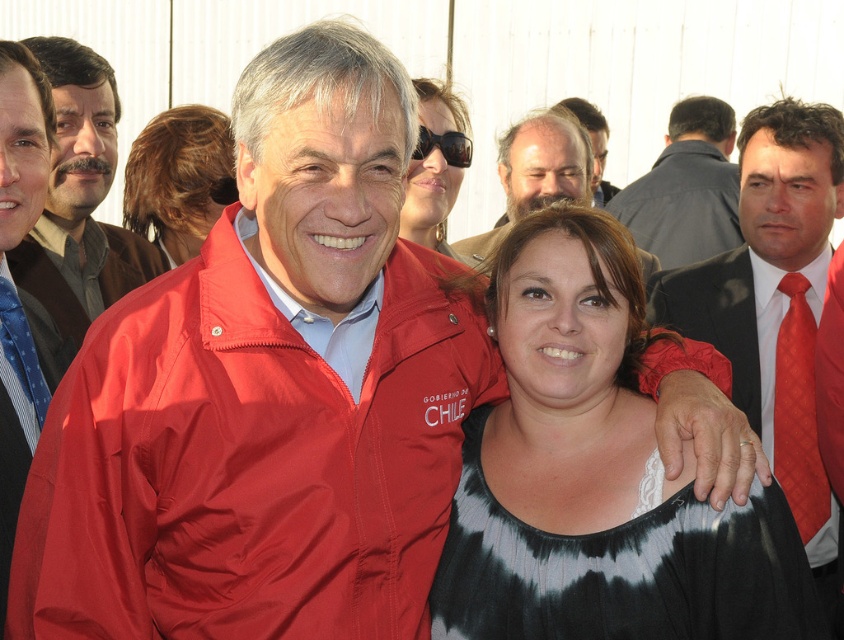
Question: Among these objects, which one is nearest to the camera?

Choices:
 (A) black plastic goggles at center
 (B) matte nylon jacket at center
 (C) sunglasses at center

Answer: (B)

Question: Does smooth brown hair at center have a larger size compared to bearded man at center?

Choices:
 (A) no
 (B) yes

Answer: (A)

Question: Considering the real-world distances, which object is closest to the matte nylon jacket at center?

Choices:
 (A) matte black jacket at left
 (B) matte black suit at left

Answer: (B)

Question: Does blue striped tie at left come behind bearded man at center?

Choices:
 (A) no
 (B) yes

Answer: (A)

Question: Can you confirm if matte black suit at left is positioned above beige textured jacket at center?

Choices:
 (A) yes
 (B) no

Answer: (B)

Question: Which object is positioned closest to the matte black suit at left?

Choices:
 (A) sunglasses at center
 (B) red textured tie at right

Answer: (A)